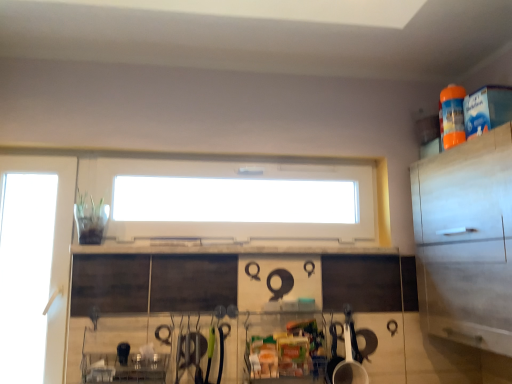
What is the approximate width of white plastic window at center?

The width of white plastic window at center is 4.14 inches.

The width and height of the screenshot is (512, 384). What do you see at coordinates (25, 273) in the screenshot?
I see `transparent glass door at left` at bounding box center [25, 273].

Where is `transparent glass door at left`? Image resolution: width=512 pixels, height=384 pixels. transparent glass door at left is located at coordinates point(25,273).

The image size is (512, 384). Describe the element at coordinates (466, 240) in the screenshot. I see `white matte cabinet at right` at that location.

You are a GUI agent. You are given a task and a screenshot of the screen. Output one action in this format:
    pyautogui.click(x=<x>, y=<y>)
    Task: Click on the white plastic window at center
    This screenshot has width=512, height=384.
    Given the screenshot: What is the action you would take?
    pyautogui.click(x=233, y=199)

From a real-world perspective, is transparent glass door at left below white glossy cup at lower center?

Incorrect, from a real-world perspective, transparent glass door at left is higher than white glossy cup at lower center.

Would you say transparent glass door at left is inside or outside white glossy cup at lower center?

The correct answer is: outside.

From the picture: Which object is closer to the camera, transparent glass door at left or white glossy cup at lower center?

white glossy cup at lower center is in front.

The image size is (512, 384). I want to click on cabinetry lying on the right of white plastic window at center, so click(x=466, y=240).

Is white matte cabinet at right positioned behind white plastic window at center?

That is False.

Which is behind, point (454, 263) or point (209, 183)?

Point (209, 183)

From a real-world perspective, is white matte cabinet at right above or below white plastic window at center?

Clearly, from a real-world perspective, white matte cabinet at right is below white plastic window at center.

From a real-world perspective, is transparent glass door at left positioned above or below white plastic window at center?

transparent glass door at left is situated lower than white plastic window at center in the real world.

Between transparent glass door at left and white plastic window at center, which one appears on the right side from the viewer's perspective?

white plastic window at center.

Considering the relative sizes of transparent glass door at left and white plastic window at center in the image provided, is transparent glass door at left shorter than white plastic window at center?

No.

Can you confirm if white plastic window at center is thinner than transparent glass door at left?

No, white plastic window at center is not thinner than transparent glass door at left.

Based on the photo, is white plastic window at center facing away from transparent glass door at left?

No, white plastic window at center is not facing the opposite direction of transparent glass door at left.

I want to click on window to the right of transparent glass door at left, so click(x=233, y=199).

How different are the orientations of white plastic window at center and white matte cabinet at right in degrees?

white plastic window at center and white matte cabinet at right are facing 90.1 degrees away from each other.

Can you confirm if white plastic window at center is thinner than white matte cabinet at right?

Yes, white plastic window at center is thinner than white matte cabinet at right.

Is white plastic window at center smaller than white matte cabinet at right?

Indeed, white plastic window at center has a smaller size compared to white matte cabinet at right.

Measure the distance from white plastic window at center to white matte cabinet at right.

white plastic window at center is 8.85 feet away from white matte cabinet at right.

Looking at the image, does white matte cabinet at right seem bigger or smaller compared to transparent glass door at left?

Clearly, white matte cabinet at right is larger in size than transparent glass door at left.

Is transparent glass door at left a part of white matte cabinet at right?

No, transparent glass door at left is located outside of white matte cabinet at right.

Is white matte cabinet at right oriented away from transparent glass door at left?

No.

Is white glossy cup at lower center oriented away from white matte cabinet at right?

No, white glossy cup at lower center is not facing away from white matte cabinet at right.

Considering the points (348, 350) and (481, 307), which point is behind, point (348, 350) or point (481, 307)?

The point (348, 350) is more distant.

Is white glossy cup at lower center closer to camera compared to white matte cabinet at right?

No.

From a real-world perspective, between white glossy cup at lower center and white matte cabinet at right, who is vertically higher?

In real-world perspective, white matte cabinet at right is above.

Locate an element on the screen. This screenshot has height=384, width=512. appliance on the right of transparent glass door at left is located at coordinates (350, 356).

You are a GUI agent. You are given a task and a screenshot of the screen. Output one action in this format:
    pyautogui.click(x=<x>, y=<y>)
    Task: Click on the window above the white matte cabinet at right (from a real-world perspective)
    This screenshot has height=384, width=512.
    Given the screenshot: What is the action you would take?
    pyautogui.click(x=233, y=199)

Estimate the real-world distances between objects in this image. Which object is further from white matte cabinet at right, transparent glass door at left or white plastic window at center?

Among the two, white plastic window at center is located further to white matte cabinet at right.

Looking at the image, which one is located closer to white plastic window at center, white matte cabinet at right or white glossy cup at lower center?

white glossy cup at lower center is closer to white plastic window at center.

From the image, which object appears to be nearer to white matte cabinet at right, white glossy cup at lower center or transparent glass door at left?

white glossy cup at lower center lies closer to white matte cabinet at right than the other object.

Consider the image. Considering their positions, is white matte cabinet at right positioned closer to transparent glass door at left than white glossy cup at lower center?

white glossy cup at lower center.

From the image, which object appears to be farther from white matte cabinet at right, white plastic window at center or transparent glass door at left?

white plastic window at center is further to white matte cabinet at right.

Looking at this image, which object lies further to the anchor point white matte cabinet at right, transparent glass door at left or white glossy cup at lower center?

The object further to white matte cabinet at right is transparent glass door at left.

Estimate the real-world distances between objects in this image. Which object is further from white glossy cup at lower center, white plastic window at center or white matte cabinet at right?

Based on the image, white plastic window at center appears to be further to white glossy cup at lower center.

Considering their positions, is white glossy cup at lower center positioned closer to transparent glass door at left than white matte cabinet at right?

Among the two, white glossy cup at lower center is located nearer to transparent glass door at left.

Identify the location of window between transparent glass door at left and white glossy cup at lower center from left to right. Image resolution: width=512 pixels, height=384 pixels. (233, 199).

Identify the location of appliance located between white plastic window at center and white matte cabinet at right in the left-right direction. (350, 356).

Find the location of a particular element. The height and width of the screenshot is (384, 512). window located between transparent glass door at left and white matte cabinet at right in the left-right direction is located at coordinates (233, 199).

This screenshot has width=512, height=384. I want to click on appliance located between transparent glass door at left and white matte cabinet at right in the left-right direction, so click(x=350, y=356).